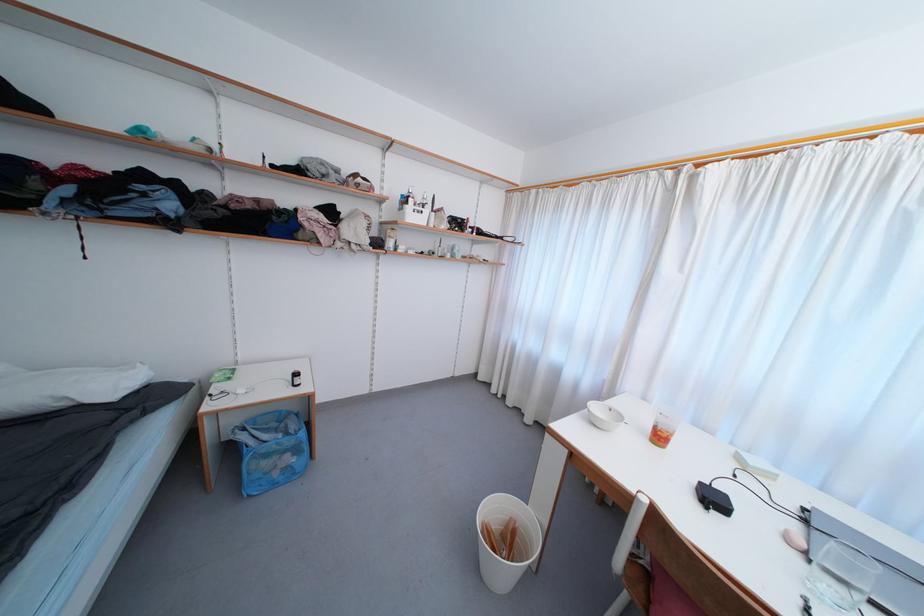
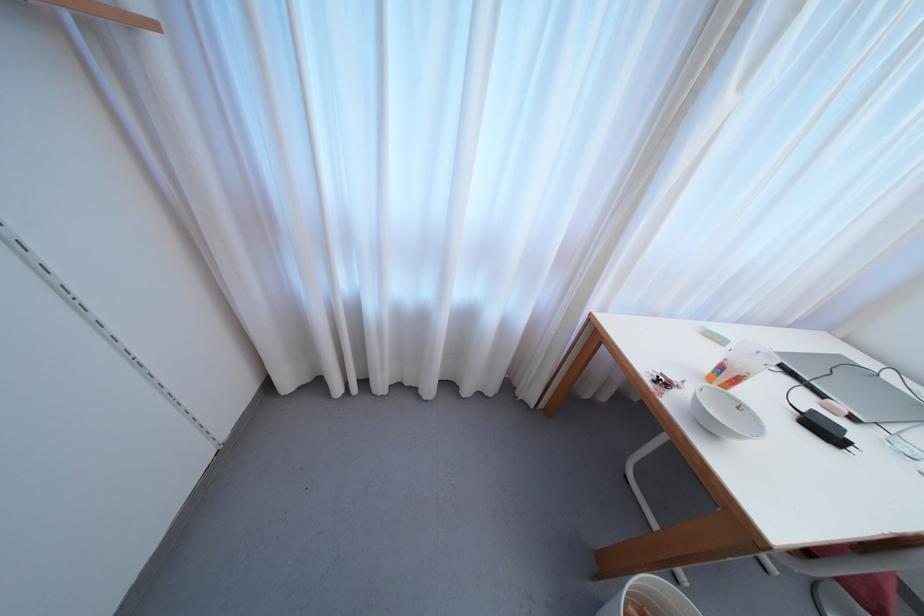
Locate, in the second image, the point that corresponds to pixel 497 392 in the first image.

(342, 392)